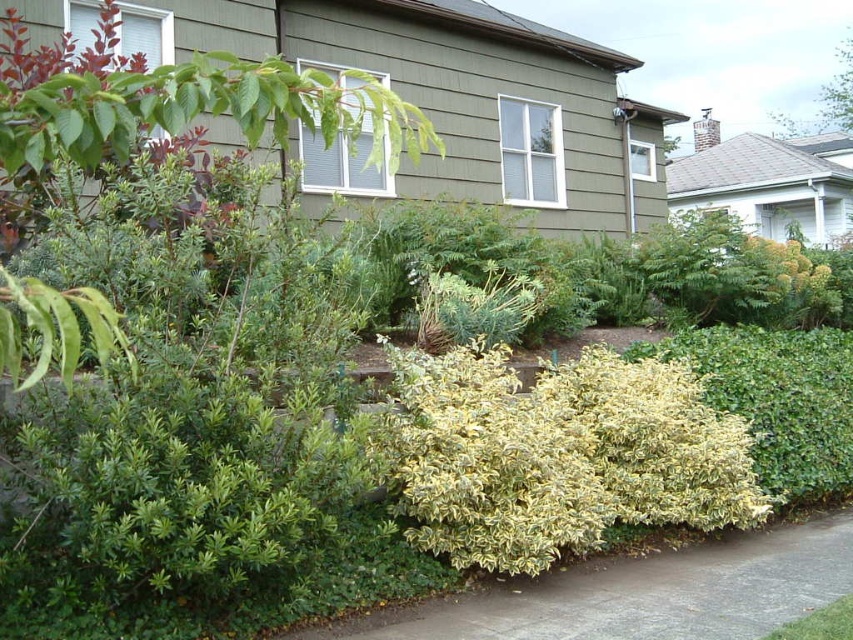
Who is higher up, gray concrete pavement at lower center or green leafy bush at upper center?

green leafy bush at upper center

Who is more forward, (633, 561) or (799, 132)?

Positioned in front is point (633, 561).

Which is behind, point (817, 595) or point (846, 45)?

The point (846, 45) is behind.

I want to click on gray concrete pavement at lower center, so click(640, 593).

Who is higher up, green leafy tree at upper left or gray concrete pavement at lower center?

green leafy tree at upper left is above.

Is green leafy tree at upper left smaller than gray concrete pavement at lower center?

Actually, green leafy tree at upper left might be larger than gray concrete pavement at lower center.

At what (x,y) coordinates should I click in order to perform the action: click on green leafy tree at upper left. Please return your answer as a coordinate pair (x, y). Looking at the image, I should click on (193, 108).

Who is positioned more to the right, green leafy tree at upper left or green leafy bush at upper center?

From the viewer's perspective, green leafy bush at upper center appears more on the right side.

Can you confirm if green leafy tree at upper left is positioned to the left of green leafy bush at upper center?

Correct, you'll find green leafy tree at upper left to the left of green leafy bush at upper center.

Locate an element on the screen. Image resolution: width=853 pixels, height=640 pixels. green leafy tree at upper left is located at coordinates (193, 108).